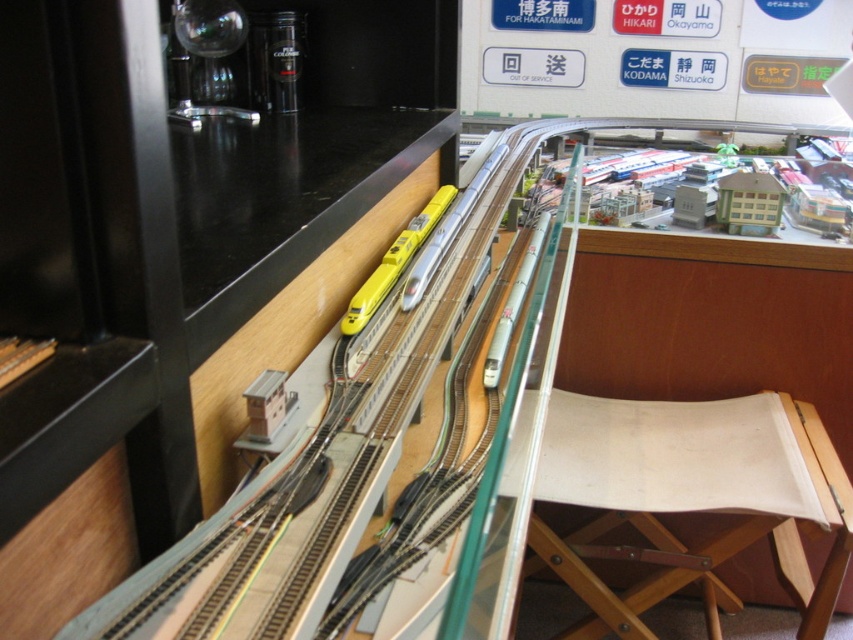
You are a visitor at the model train exhibit and want to sit down to observe the yellow bullet train and white train. Where is the beige canvas chair at right located?

The beige canvas chair at right is located at point 0.780 on the x axis and 0.808 on the y axis.

You are a visitor at the model train exhibit and want to sit down to observe the yellow bullet train and white train on the tracks. There is a beige canvas chair at right. Will sitting in this chair allow you to see both the yellow bullet train and white train clearly?

The beige canvas chair at right is located at point (x=688, y=499), which is positioned to the right side of the scene. Since both the yellow bullet train and white train are on the tracks in the center area of the model setup, the chair at the right might have a clear view of both trains as they move along the tracks. However, without specific information about obstructions or the chair